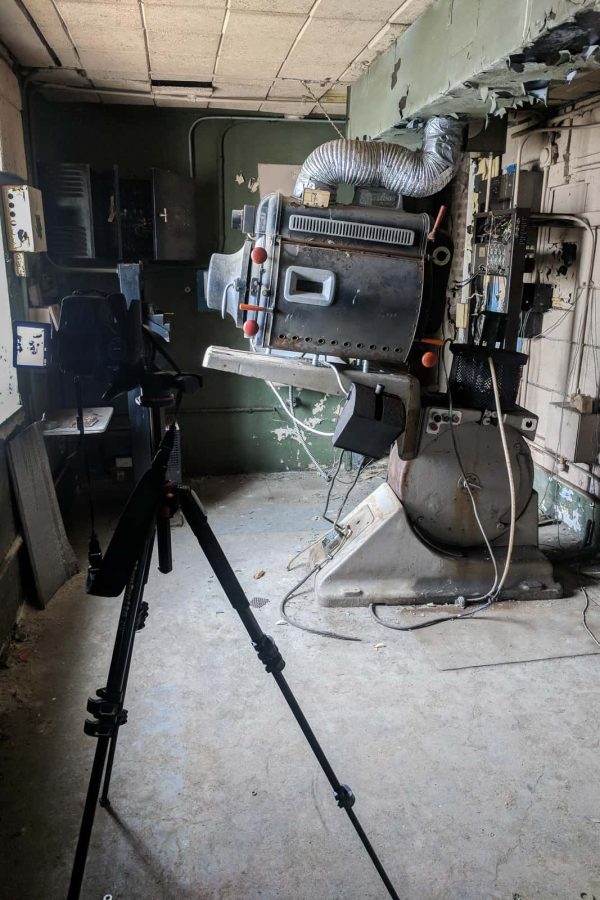
You are a GUI agent. You are given a task and a screenshot of the screen. Output one action in this format:
    pyautogui.click(x=<x>, y=<y>)
    Task: Click on the concrete floor
    Image resolution: width=600 pixels, height=900 pixels.
    Given the screenshot: What is the action you would take?
    pyautogui.click(x=482, y=738)